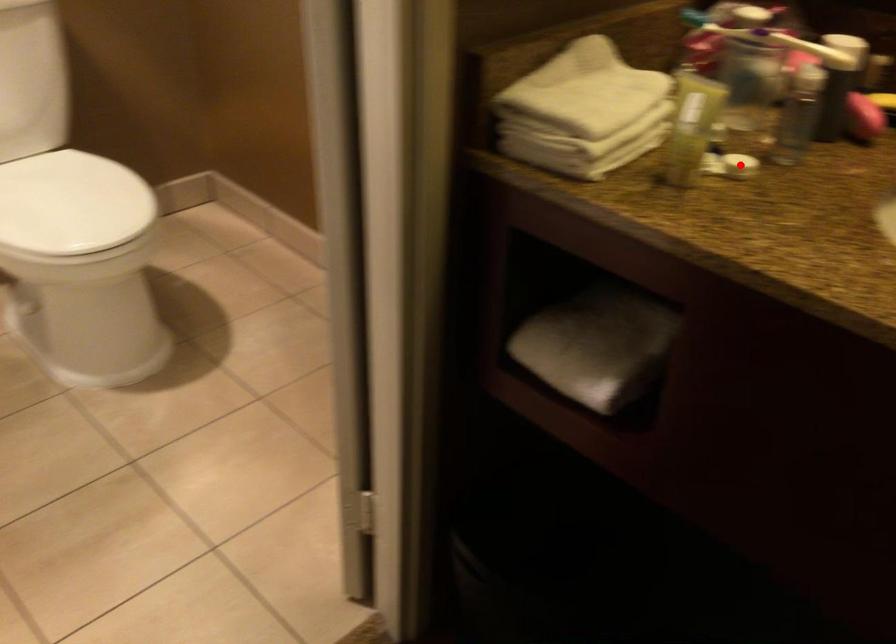
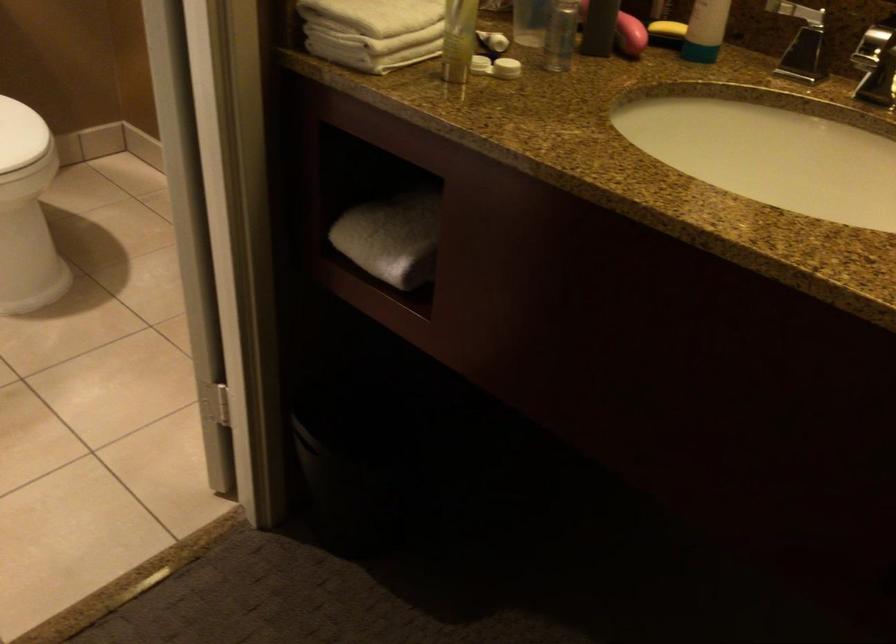
Where in the second image is the point corresponding to the highlighted location from the first image?

(506, 68)